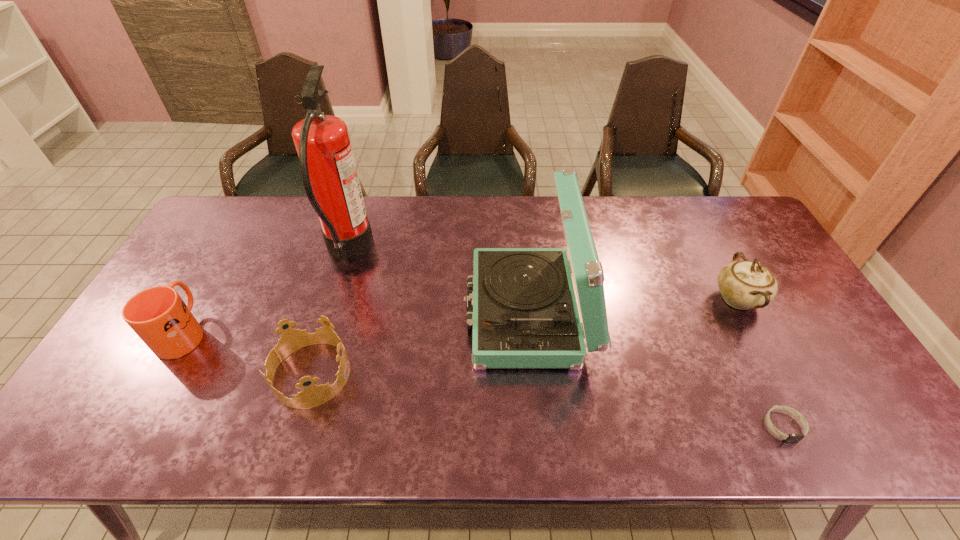
Locate an element on the screen. Image resolution: width=960 pixels, height=540 pixels. object that is at the right edge is located at coordinates (744, 285).

This screenshot has width=960, height=540. Identify the location of free region at the far edge of the desktop. (658, 202).

The image size is (960, 540). In order to click on blank space at the near edge of the desktop in this screenshot , I will do `click(708, 438)`.

Where is `vacant space at the left edge of the desktop`? The height and width of the screenshot is (540, 960). vacant space at the left edge of the desktop is located at coordinates (206, 265).

This screenshot has height=540, width=960. What are the coordinates of `vacant area at the right edge of the desktop` in the screenshot? It's located at (815, 357).

Where is `vacant space at the far left corner of the desktop`? vacant space at the far left corner of the desktop is located at coordinates (255, 197).

Where is `free spot at the far right corner of the desktop`? free spot at the far right corner of the desktop is located at coordinates (735, 228).

The image size is (960, 540). Identify the location of vacant point located between the record player and the tiara. point(420,343).

At what (x,y) coordinates should I click in order to perform the action: click on free point between the leftmost object and the chinaware. Please return your answer as a coordinate pair (x, y). Looking at the image, I should click on (461, 315).

The image size is (960, 540). Find the location of `free space between the mug and the second shortest object`. free space between the mug and the second shortest object is located at coordinates (248, 353).